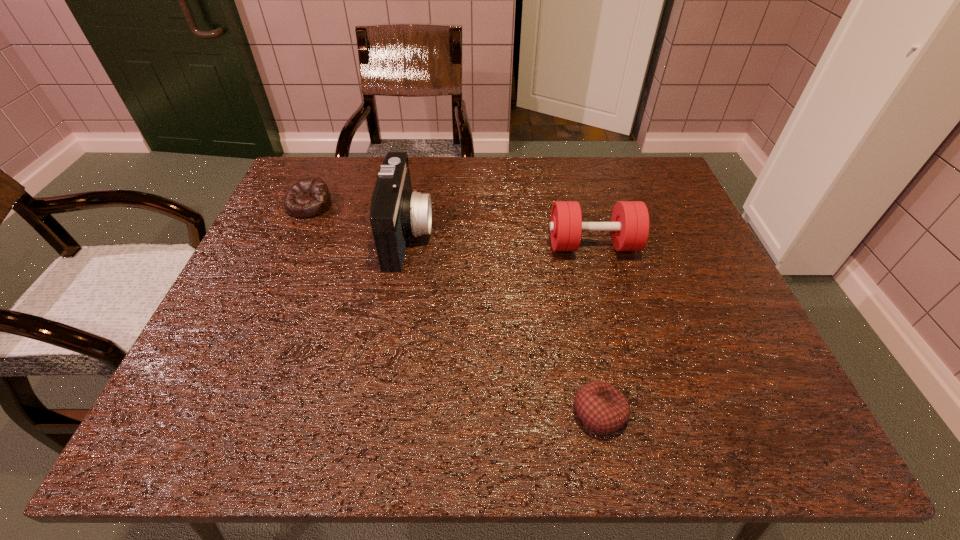
Identify the location of free space located on the right of the nearest object. The height and width of the screenshot is (540, 960). (737, 413).

Find the location of a particular element. The width and height of the screenshot is (960, 540). camcorder at the far edge is located at coordinates (396, 212).

This screenshot has width=960, height=540. Find the location of `beanbag that is at the far edge`. beanbag that is at the far edge is located at coordinates (309, 197).

The width and height of the screenshot is (960, 540). Find the location of `object that is at the near edge`. object that is at the near edge is located at coordinates click(x=601, y=407).

Find the location of a particular element. object positioned at the left edge is located at coordinates (309, 197).

This screenshot has width=960, height=540. Find the location of `object positioned at the far left corner`. object positioned at the far left corner is located at coordinates (309, 197).

You are a GUI agent. You are given a task and a screenshot of the screen. Output one action in this format:
    pyautogui.click(x=<x>, y=<y>)
    Task: Click on the free space at the far edge of the desktop
    The width and height of the screenshot is (960, 540).
    Given the screenshot: What is the action you would take?
    pyautogui.click(x=605, y=180)

In the image, there is a desktop. Identify the location of free space at the near edge. (411, 408).

In the image, there is a desktop. Where is `free space at the left edge`? The width and height of the screenshot is (960, 540). free space at the left edge is located at coordinates [x=248, y=316].

Where is `vacant space at the right edge of the desktop`? The height and width of the screenshot is (540, 960). vacant space at the right edge of the desktop is located at coordinates (699, 341).